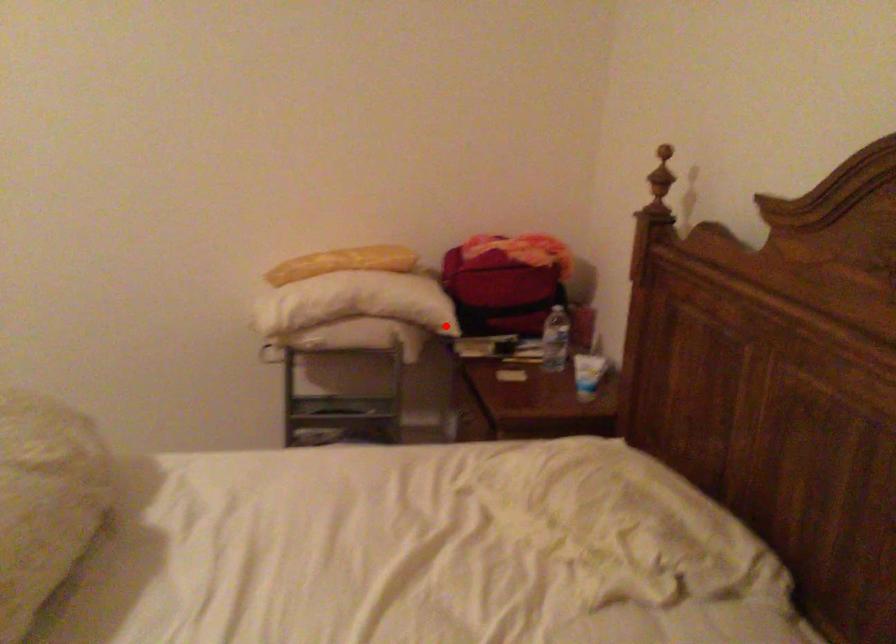
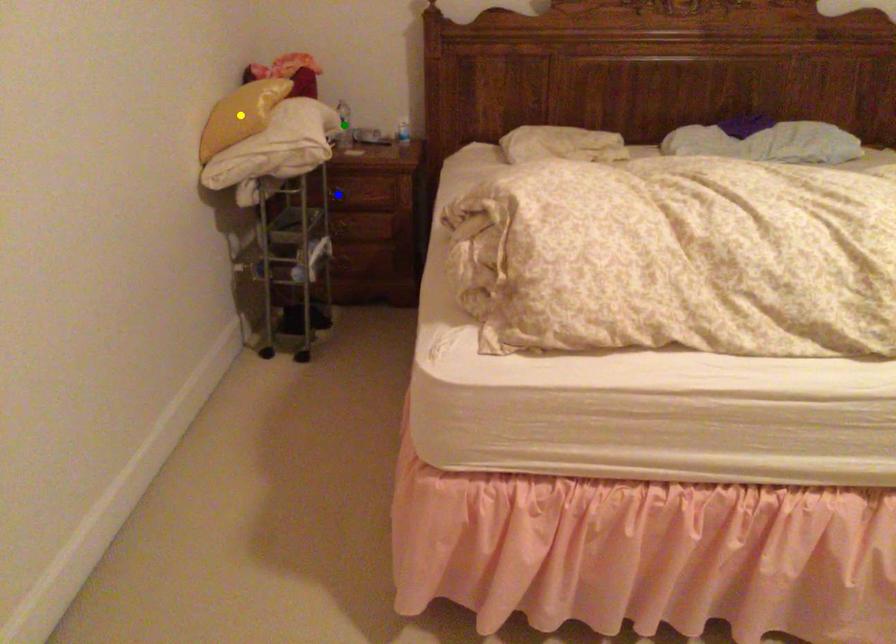
Question: I am providing you with two images of the same scene from different viewpoints. A red point is marked on the first image. You are given multiple points on the second image. In image 2, which mark is for the same physical point as the one in image 1?

Choices:
 (A) blue point
 (B) yellow point
 (C) green point

Answer: (C)